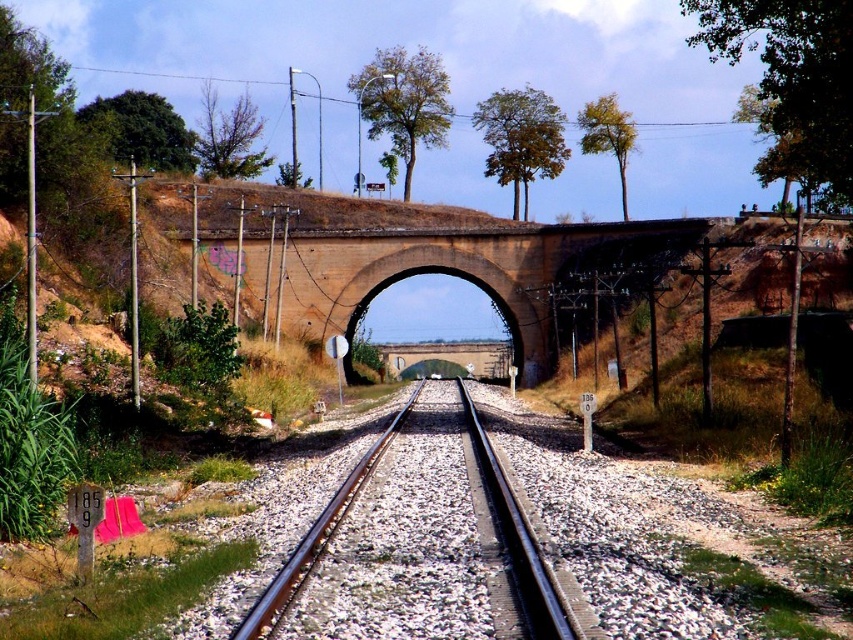
Question: Does brown brick bridge at center have a lesser width compared to black metal train track at center?

Choices:
 (A) no
 (B) yes

Answer: (A)

Question: Which of the following is the closest to the observer?

Choices:
 (A) (466, 412)
 (B) (601, 236)

Answer: (A)

Question: Does brown brick bridge at center have a smaller size compared to black metal train track at center?

Choices:
 (A) yes
 (B) no

Answer: (B)

Question: Does brown brick bridge at center have a larger size compared to black metal train track at center?

Choices:
 (A) yes
 (B) no

Answer: (A)